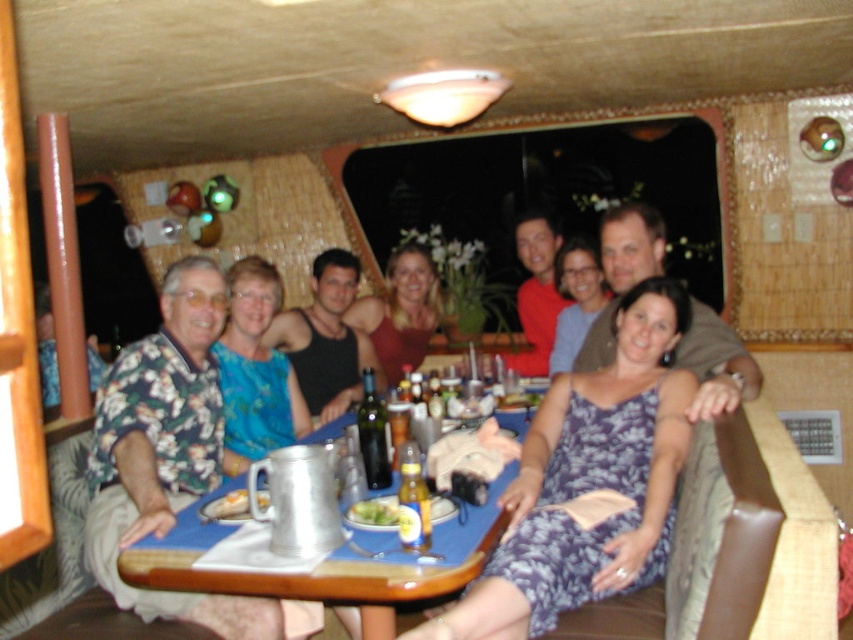
Question: Is blue floral dress at center below floral dress at center?

Choices:
 (A) no
 (B) yes

Answer: (B)

Question: Which point is closer to the camera taking this photo?

Choices:
 (A) (583, 241)
 (B) (676, 380)
 (C) (364, 416)
 (D) (405, 484)

Answer: (D)

Question: Which object is the farthest from the brushed metal table at center?

Choices:
 (A) translucent glass bottle at table center
 (B) metallic silver wine bottle at center

Answer: (B)

Question: Can you confirm if translucent glass bottle at table center is positioned to the right of metallic silver wine bottle at center?

Choices:
 (A) yes
 (B) no

Answer: (A)

Question: Is brushed metal table at center above metallic silver wine bottle at center?

Choices:
 (A) yes
 (B) no

Answer: (B)

Question: Which object is farther from the camera taking this photo?

Choices:
 (A) brushed metal table at center
 (B) blue floral dress at center

Answer: (B)